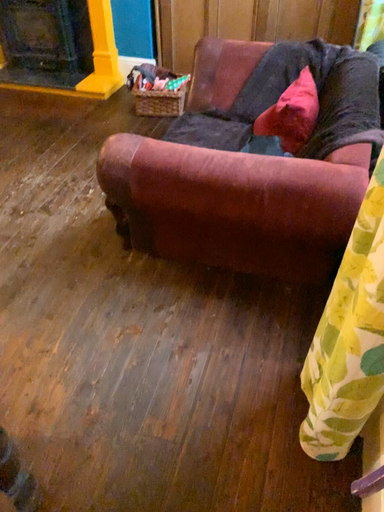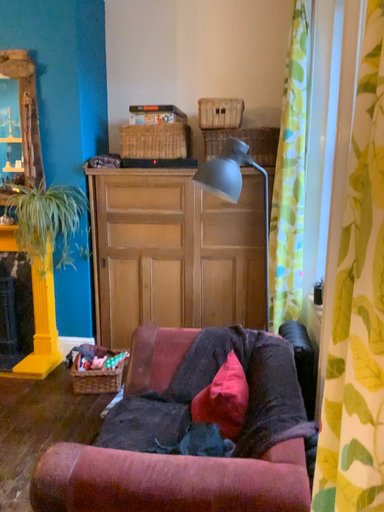
Question: Which way did the camera rotate in the video?

Choices:
 (A) rotated right
 (B) rotated left

Answer: (A)